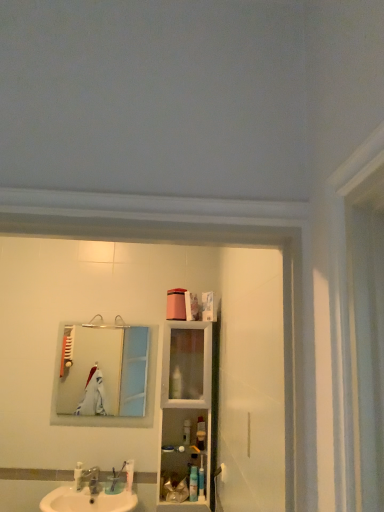
Locate an element on the screen. The width and height of the screenshot is (384, 512). free spot to the left of white plastic toothbrush at lower left, marked as the first toiletry in a left-to-right arrangement is located at coordinates (59, 493).